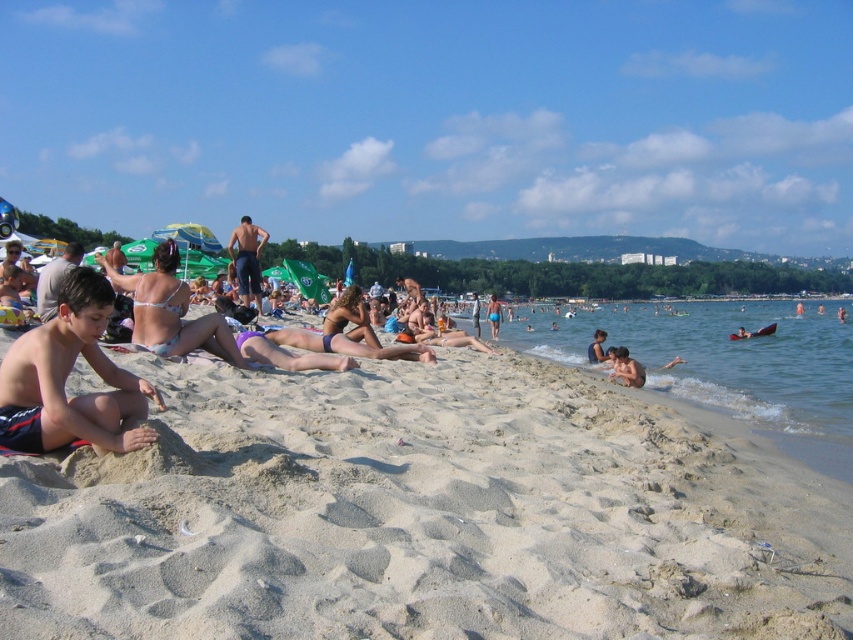
You are a drone operator trying to capture a photo of the light beige sand at lower left. The drone is currently at coordinates 0.805, 0.497. Is the drone positioned correctly to take the photo?

Yes, the light beige sand at lower left is located at coordinates (422, 515), so the drone is correctly positioned to take the photo.

You are standing on the beach and see the light beige sand at lower left and the dark blue shorts at center. Which object is located to the right of the other?

The light beige sand at lower left is to the right of the dark blue shorts at center.